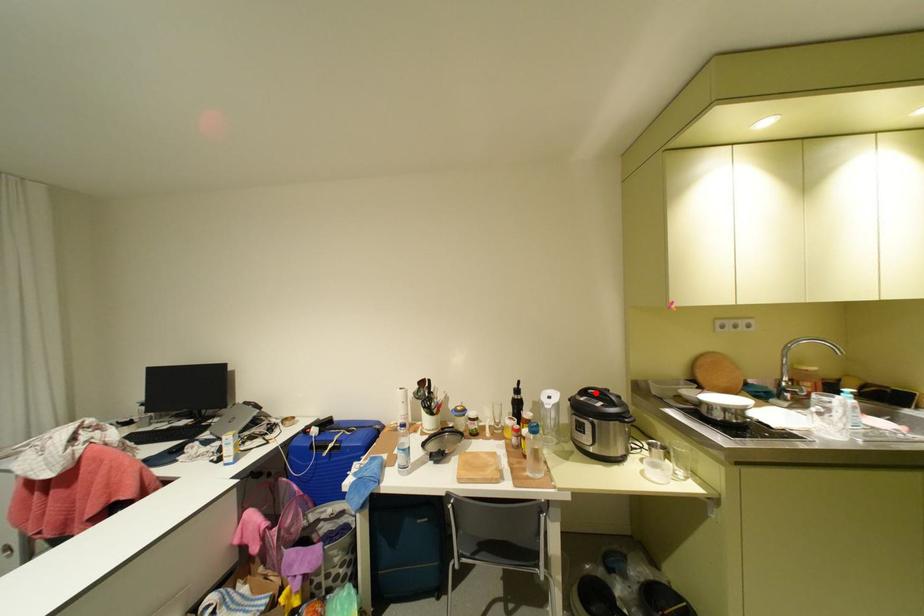
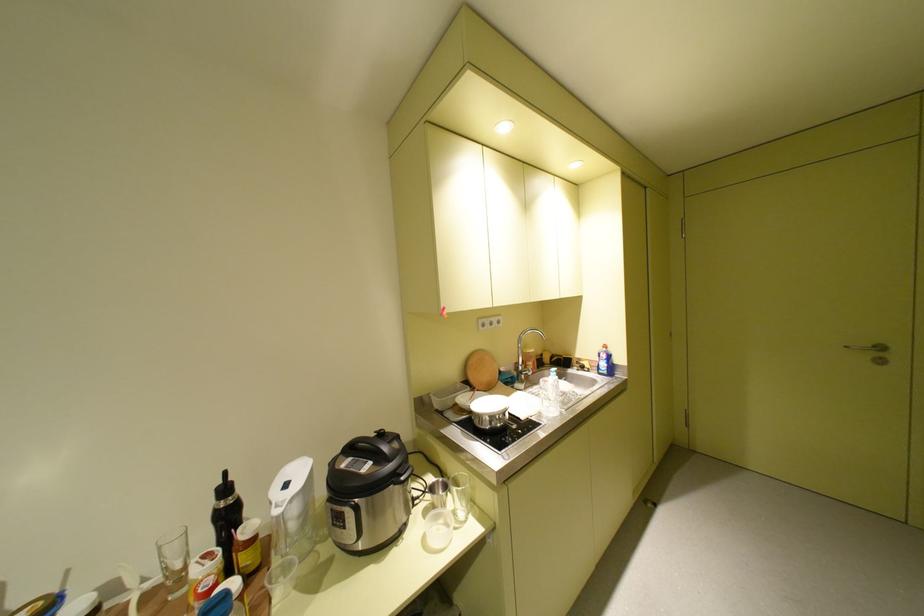
The point at the highlighted location is marked in the first image. Where is the corresponding point in the second image?

(361, 448)